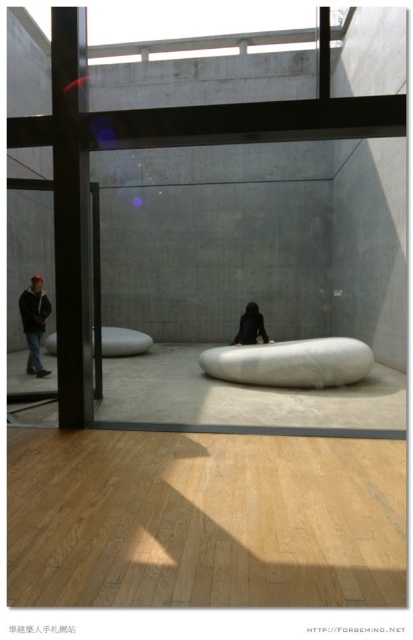
You are a GUI agent. You are given a task and a screenshot of the screen. Output one action in this format:
    pyautogui.click(x=<x>, y=<y>)
    Task: Click on the dark gray hoodie at left
    The width and height of the screenshot is (413, 640).
    Given the screenshot: What is the action you would take?
    pyautogui.click(x=33, y=323)

Is point (44, 294) closer to camera compared to point (239, 340)?

Yes, it is.

This screenshot has width=413, height=640. I want to click on dark gray hoodie at left, so click(33, 323).

How distant is black metal/texture pillar at left from dark brown leather jacket at center?

The distance of black metal/texture pillar at left from dark brown leather jacket at center is 16.36 feet.

This screenshot has width=413, height=640. Describe the element at coordinates (71, 216) in the screenshot. I see `black metal/texture pillar at left` at that location.

Between point (59, 154) and point (234, 339), which one is positioned behind?

The point (234, 339) is more distant.

Identify the location of black metal/texture pillar at left. (71, 216).

Between black metal/texture pillar at left and dark gray hoodie at left, which one has less height?

dark gray hoodie at left is shorter.

Measure the distance between black metal/texture pillar at left and dark gray hoodie at left.

black metal/texture pillar at left is 4.25 meters from dark gray hoodie at left.

Between point (87, 392) and point (40, 301), which one is positioned in front?

Positioned in front is point (87, 392).

Identify the location of black metal/texture pillar at left. (71, 216).